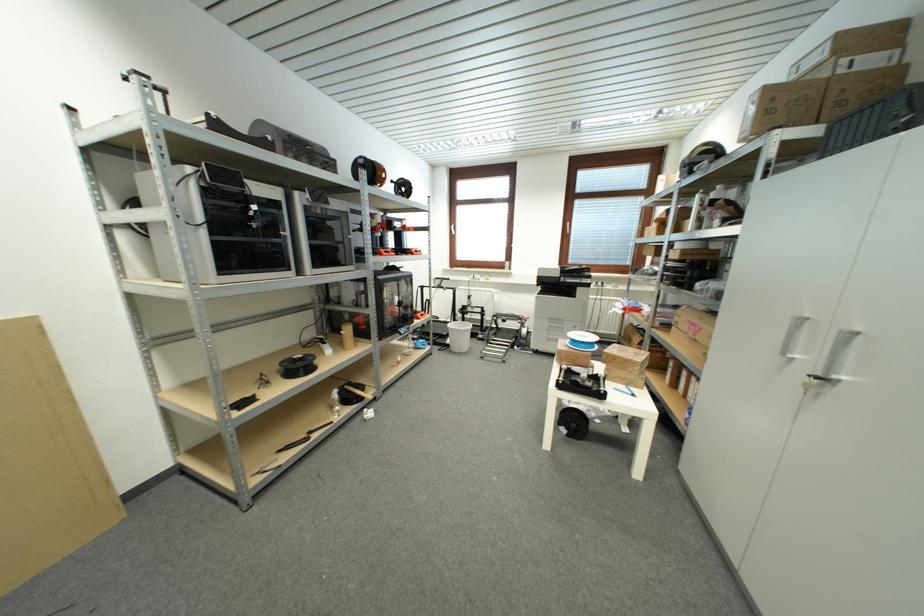
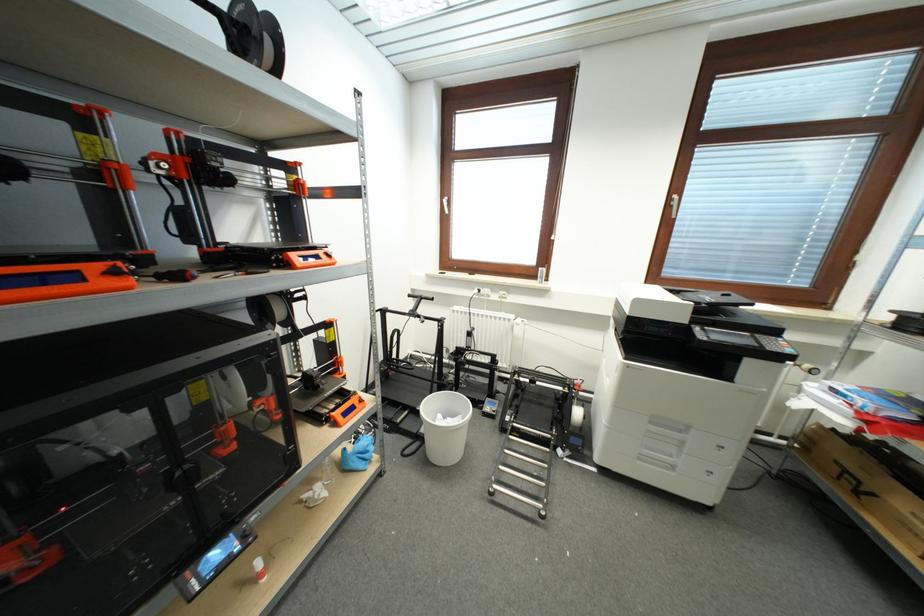
Question: I am providing you with two images of the same scene from different viewpoints. Please identify which objects are invisible in image2.

Choices:
 (A) white window handle
 (B) printer tray handle
 (C) silver window handle
 (D) none of these

Answer: (D)